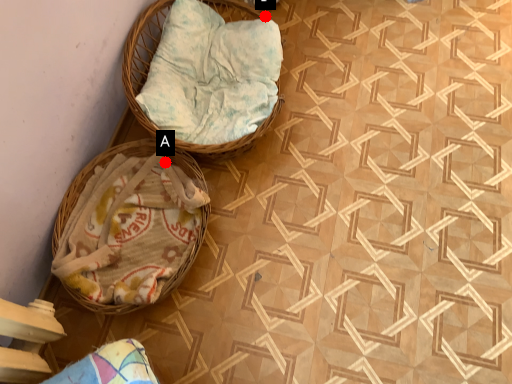
Question: Two points are circled on the image, labeled by A and B beside each circle. Which point is further to the camera?

Choices:
 (A) A is further
 (B) B is further

Answer: (B)